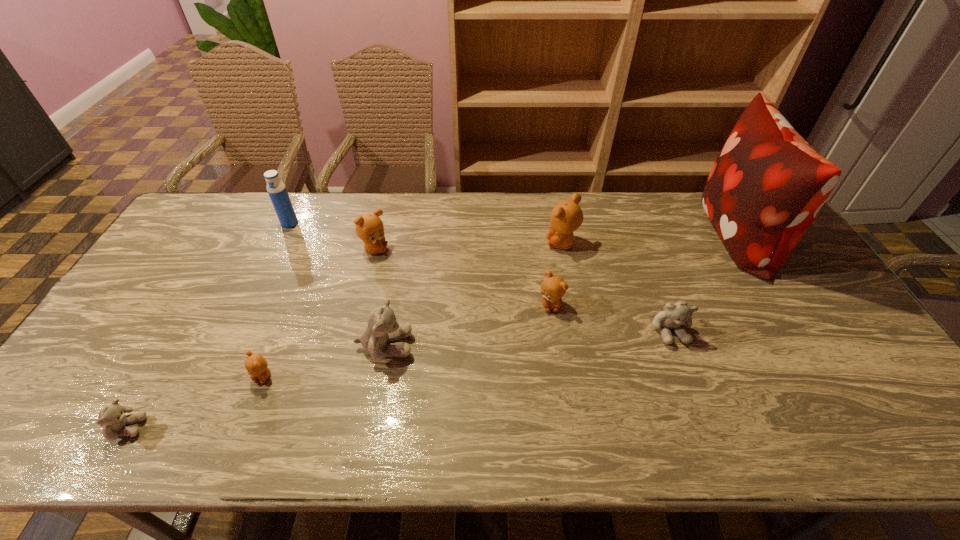
At what (x,y) coordinates should I click in order to perform the action: click on object situated at the near edge. Please return your answer as a coordinate pair (x, y). This screenshot has height=540, width=960. Looking at the image, I should click on tap(112, 417).

Where is `object present at the left edge`? This screenshot has height=540, width=960. object present at the left edge is located at coordinates (112, 417).

I want to click on object that is at the right edge, so click(x=765, y=189).

I want to click on object positioned at the near left corner, so click(x=112, y=417).

Find the location of a particular element. The width and height of the screenshot is (960, 540). object that is at the far right corner is located at coordinates (765, 189).

Where is `free location at the far edge of the desktop`? This screenshot has width=960, height=540. free location at the far edge of the desktop is located at coordinates (476, 208).

At what (x,y) coordinates should I click in order to perform the action: click on vacant space at the near edge of the desktop. Please return your answer as a coordinate pair (x, y). Image resolution: width=960 pixels, height=540 pixels. Looking at the image, I should click on (115, 446).

In the image, there is a desktop. Where is `vacant space at the left edge`? This screenshot has height=540, width=960. vacant space at the left edge is located at coordinates (174, 282).

In the image, there is a desktop. Where is `vacant space at the right edge`? Image resolution: width=960 pixels, height=540 pixels. vacant space at the right edge is located at coordinates [871, 364].

Locate an element on the screen. The height and width of the screenshot is (540, 960). vacant space at the far left corner of the desktop is located at coordinates (190, 224).